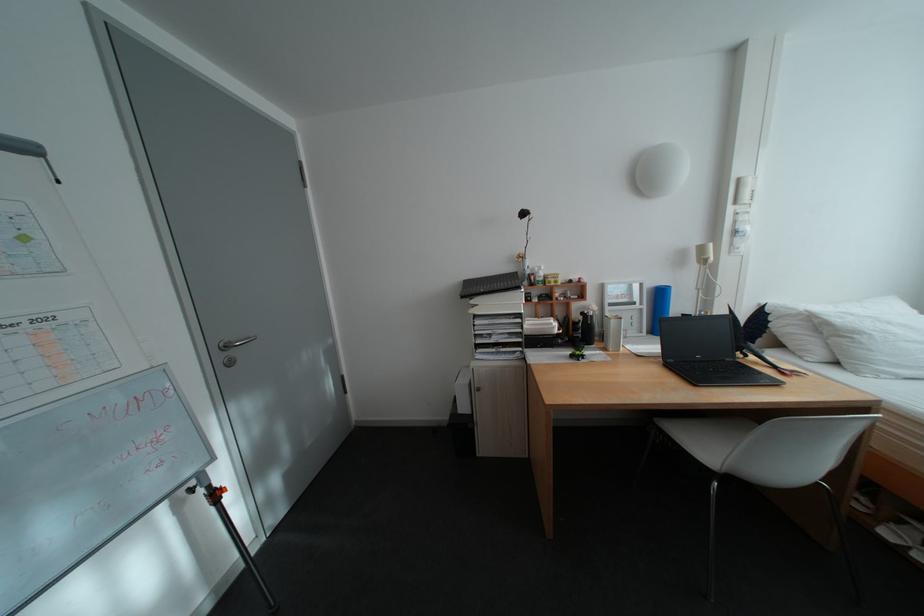
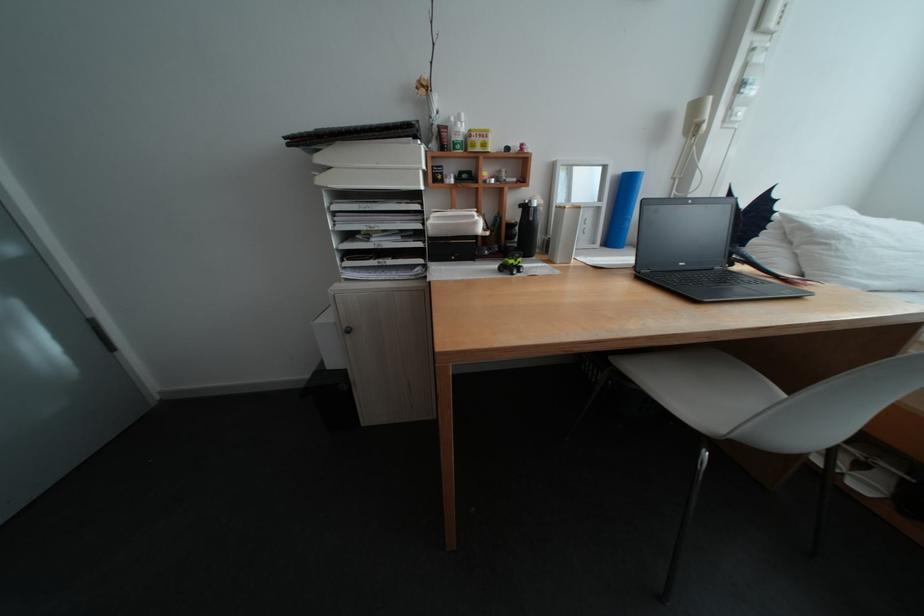
Where in the second image is the point corresponding to the point at 562,278 from the first image?

(485, 135)